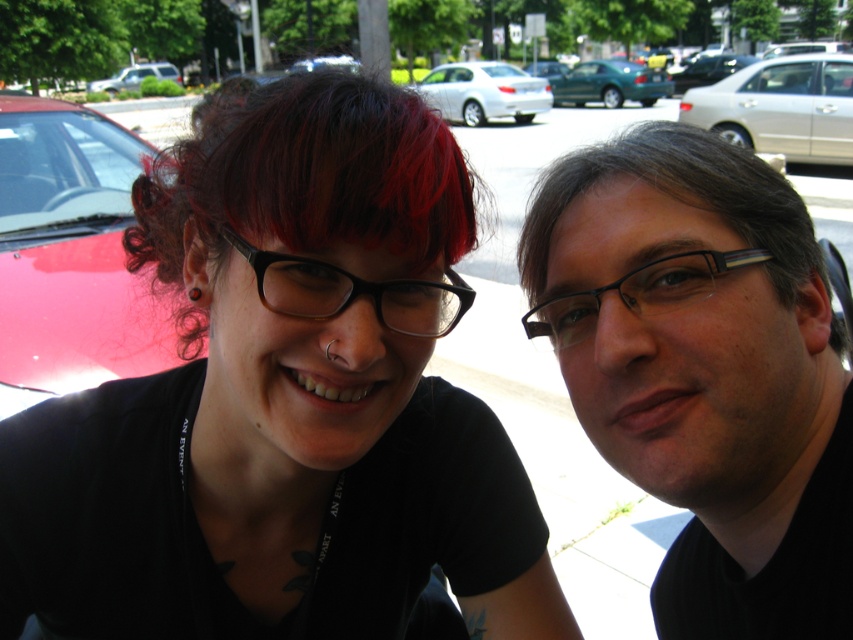
This screenshot has height=640, width=853. What do you see at coordinates (704, 371) in the screenshot?
I see `matte black glasses at center` at bounding box center [704, 371].

Is point (845, 456) positioned before point (740, 54)?

That is True.

At what (x,y) coordinates should I click in order to perform the action: click on matte black glasses at center. Please return your answer as a coordinate pair (x, y). The width and height of the screenshot is (853, 640). Looking at the image, I should click on (704, 371).

Is matte black glasses at center smaller than black plastic glasses at center?

Actually, matte black glasses at center might be larger than black plastic glasses at center.

You are a GUI agent. You are given a task and a screenshot of the screen. Output one action in this format:
    pyautogui.click(x=<x>, y=<y>)
    Task: Click on the matte black glasses at center
    The height and width of the screenshot is (640, 853).
    Given the screenshot: What is the action you would take?
    tap(704, 371)

Locate an element on the screen. The width and height of the screenshot is (853, 640). matte black glasses at center is located at coordinates (704, 371).

Based on the photo, can you confirm if gray matte hair at upper right is positioned above black plastic glasses at center?

Yes, gray matte hair at upper right is above black plastic glasses at center.

In the scene shown: Can you confirm if gray matte hair at upper right is shorter than black plastic glasses at center?

Incorrect, gray matte hair at upper right's height does not fall short of black plastic glasses at center's.

Who is more distant from viewer, (541, 240) or (310, 264)?

The point (541, 240) is behind.

What are the coordinates of `gray matte hair at upper right` in the screenshot? It's located at (680, 196).